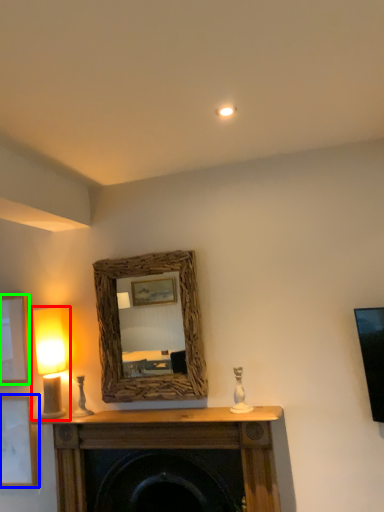
Question: Considering the real-world distances, which object is farthest from table lamp (highlighted by a red box)? picture frame (highlighted by a blue box) or picture frame (highlighted by a green box)?

Choices:
 (A) picture frame
 (B) picture frame

Answer: (A)